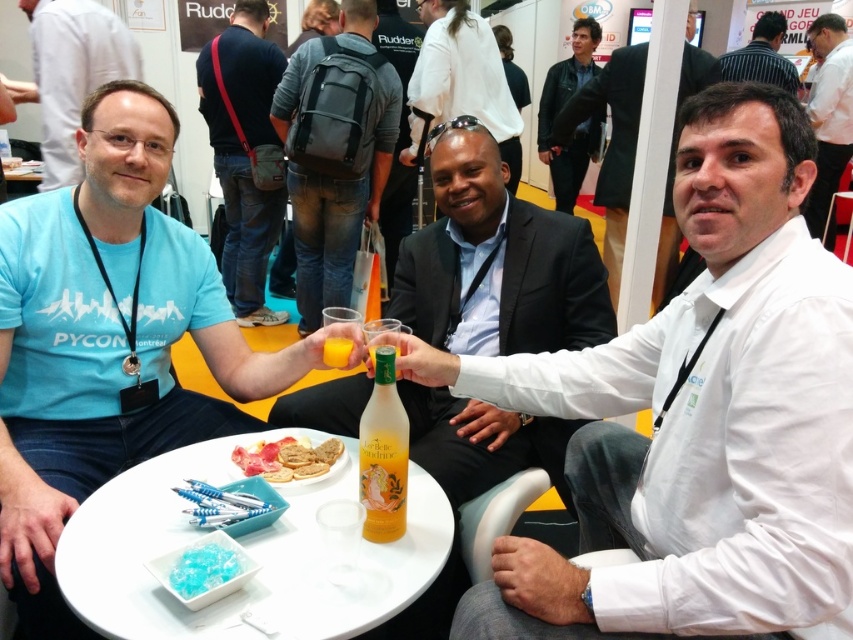
Question: In this image, where is white shirt at center located relative to dark blue leather jacket at upper center?

Choices:
 (A) below
 (B) above

Answer: (A)

Question: Which is nearer to the white shirt at center?

Choices:
 (A) smooth white plate at center
 (B) matte black suit at center
 (C) white glossy bottle at center

Answer: (B)

Question: Does matte black backpack at center have a greater width compared to striped shirt at upper center?

Choices:
 (A) yes
 (B) no

Answer: (B)

Question: Which object is closer to the camera taking this photo?

Choices:
 (A) translucent blue candy at lower center
 (B) yellow glass bottle at center
 (C) dark suit at center

Answer: (A)

Question: Which of the following is the closest to the observer?

Choices:
 (A) white shirt at upper center
 (B) matte black backpack at center
 (C) matte black suit at center
 (D) dark blue leather jacket at upper center

Answer: (C)

Question: Does white plastic table at center appear on the right side of dark blue leather jacket at upper center?

Choices:
 (A) no
 (B) yes

Answer: (A)